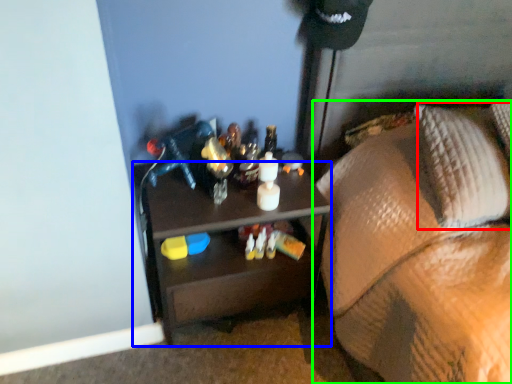
Question: Which object is the farthest from pillow (highlighted by a red box)? Choose among these: desk (highlighted by a blue box) or furniture (highlighted by a green box).

Choices:
 (A) desk
 (B) furniture

Answer: (A)